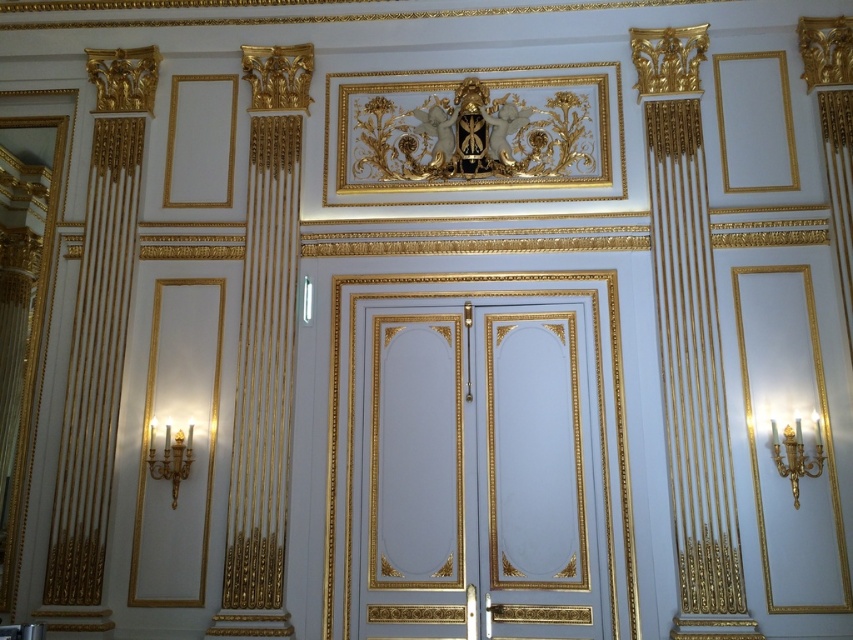
Question: Which point appears farthest from the camera in this image?

Choices:
 (A) pos(796,452)
 (B) pos(173,490)

Answer: (B)

Question: Does gold metallic chandelier at right appear under gold metallic chandelier at lower left?

Choices:
 (A) yes
 (B) no

Answer: (B)

Question: Is gold metallic chandelier at right to the right of gold metallic chandelier at lower left from the viewer's perspective?

Choices:
 (A) yes
 (B) no

Answer: (A)

Question: Which point is closer to the camera taking this photo?

Choices:
 (A) (793, 483)
 (B) (186, 456)

Answer: (A)

Question: Does gold metallic chandelier at right appear on the right side of gold metallic chandelier at lower left?

Choices:
 (A) no
 (B) yes

Answer: (B)